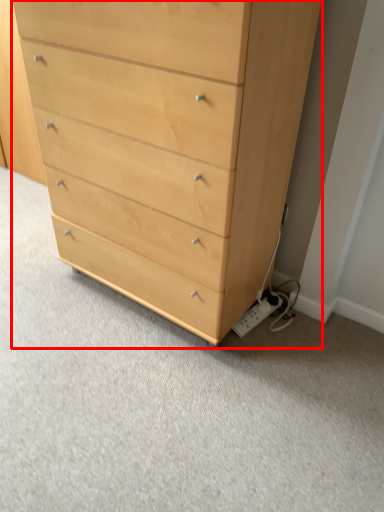
Question: Considering the relative positions of chest of drawers (annotated by the red box) and electric outlet in the image provided, where is chest of drawers (annotated by the red box) located with respect to the staircase?

Choices:
 (A) right
 (B) left

Answer: (B)